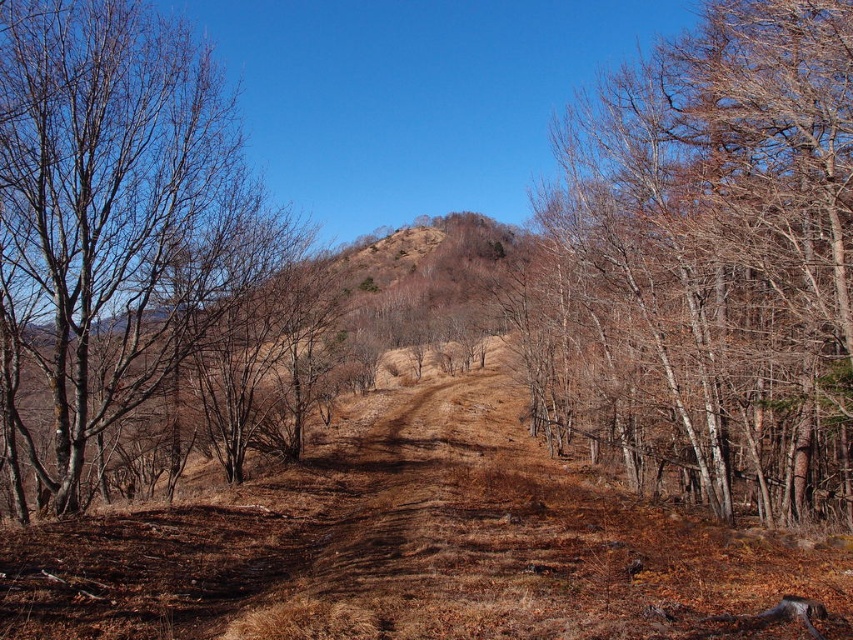
You are a hiker standing on the dirt path and want to take a photo of both the brown bark tree at right and the bare branches at left. Which tree should you focus on first if you want to capture both in the same frame without moving the camera?

The brown bark tree at right is taller than the bare branches at left, so you should focus on the brown bark tree at right first to ensure both are in the frame.

You are a hiker standing on the dirt path in the foreground. You notice a brown bark tree at right and bare branches at left. Which object is positioned higher in the image?

The brown bark tree at right is located above the bare branches at left in the image.